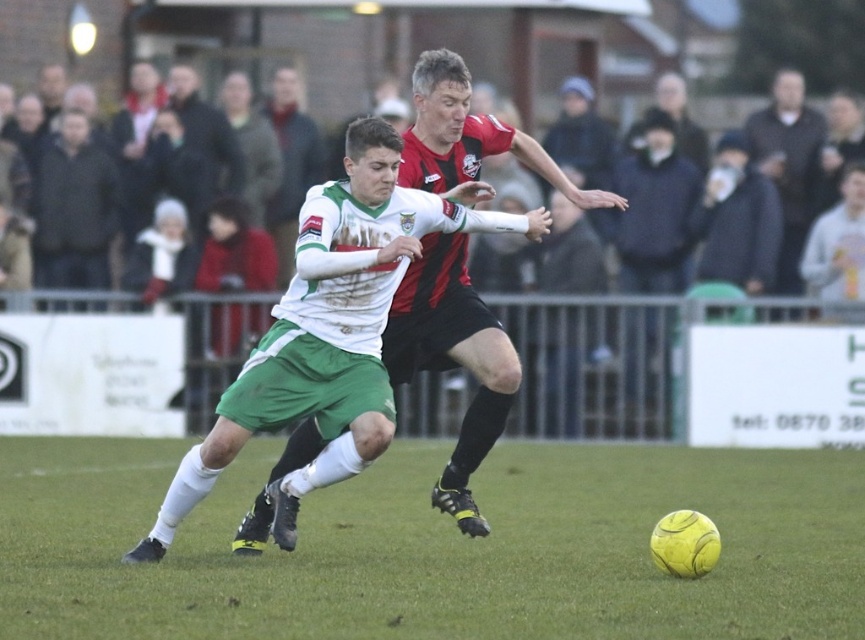
Question: Can you confirm if yellow rubber ball at center is positioned to the left of white jersey at center?

Choices:
 (A) no
 (B) yes

Answer: (B)

Question: Based on their relative distances, which object is nearer to the white jersey at center?

Choices:
 (A) yellow rubber ball at center
 (B) dark gray jacket at upper left

Answer: (A)

Question: Which point is closer to the camera?

Choices:
 (A) (88, 157)
 (B) (501, 145)

Answer: (B)

Question: From the image, what is the correct spatial relationship of yellow rubber ball at center in relation to white jersey at center?

Choices:
 (A) below
 (B) above

Answer: (A)

Question: Considering the relative positions of white jersey at center and dark gray jacket at upper left in the image provided, where is white jersey at center located with respect to dark gray jacket at upper left?

Choices:
 (A) left
 (B) right

Answer: (B)

Question: Among these points, which one is farthest from the camera?

Choices:
 (A) (268, 609)
 (B) (75, 134)

Answer: (B)